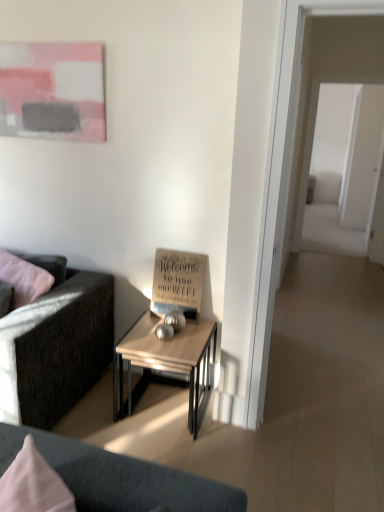
Question: From the image's perspective, is dark gray fabric couch at left located above matte pink painting at upper left?

Choices:
 (A) yes
 (B) no

Answer: (B)

Question: From the image's perspective, does dark gray fabric couch at left appear lower than matte pink painting at upper left?

Choices:
 (A) yes
 (B) no

Answer: (A)

Question: Does dark gray fabric couch at left have a lesser height compared to matte pink painting at upper left?

Choices:
 (A) yes
 (B) no

Answer: (B)

Question: Does dark gray fabric couch at left have a smaller size compared to matte pink painting at upper left?

Choices:
 (A) no
 (B) yes

Answer: (A)

Question: Is matte pink painting at upper left surrounded by dark gray fabric couch at left?

Choices:
 (A) yes
 (B) no

Answer: (B)

Question: From a real-world perspective, relative to dark gray fabric couch at left, is matte pink painting at upper left vertically above or below?

Choices:
 (A) above
 (B) below

Answer: (A)

Question: In the image, is matte pink painting at upper left on the left side or the right side of dark gray fabric couch at left?

Choices:
 (A) left
 (B) right

Answer: (B)

Question: In terms of size, does matte pink painting at upper left appear bigger or smaller than dark gray fabric couch at left?

Choices:
 (A) small
 (B) big

Answer: (A)

Question: Considering the positions of point (36, 124) and point (100, 304), is point (36, 124) closer or farther from the camera than point (100, 304)?

Choices:
 (A) closer
 (B) farther

Answer: (A)

Question: Considering the positions of point (170, 359) and point (307, 113), is point (170, 359) closer or farther from the camera than point (307, 113)?

Choices:
 (A) closer
 (B) farther

Answer: (A)

Question: From the image's perspective, is wooden table at center above or below transparent glass door at right?

Choices:
 (A) below
 (B) above

Answer: (A)

Question: Considering the relative positions of wooden table at center and transparent glass door at right in the image provided, is wooden table at center to the left or to the right of transparent glass door at right?

Choices:
 (A) right
 (B) left

Answer: (B)

Question: Is wooden table at center bigger or smaller than transparent glass door at right?

Choices:
 (A) big
 (B) small

Answer: (B)

Question: Considering the positions of wooden table at center and dark gray fabric couch at left in the image, is wooden table at center bigger or smaller than dark gray fabric couch at left?

Choices:
 (A) small
 (B) big

Answer: (A)

Question: Is wooden table at center to the left or to the right of dark gray fabric couch at left in the image?

Choices:
 (A) right
 (B) left

Answer: (A)